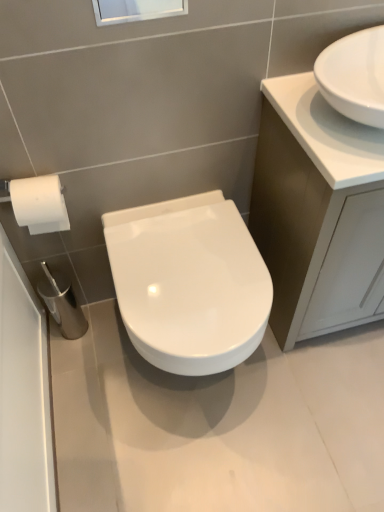
Question: From the image's perspective, is white glossy cabinet at upper right located above or below transparent glass window screen at upper center?

Choices:
 (A) below
 (B) above

Answer: (A)

Question: From a real-world perspective, relative to transparent glass window screen at upper center, is white glossy cabinet at upper right vertically above or below?

Choices:
 (A) below
 (B) above

Answer: (A)

Question: Which object is positioned farthest from the transparent glass window screen at upper center?

Choices:
 (A) white glossy cabinet at upper right
 (B) white glossy sink at upper right
 (C) white glossy toilet at center

Answer: (A)

Question: Which is farther from the white glossy toilet at center?

Choices:
 (A) transparent glass window screen at upper center
 (B) white glossy sink at upper right
 (C) white glossy cabinet at upper right

Answer: (A)